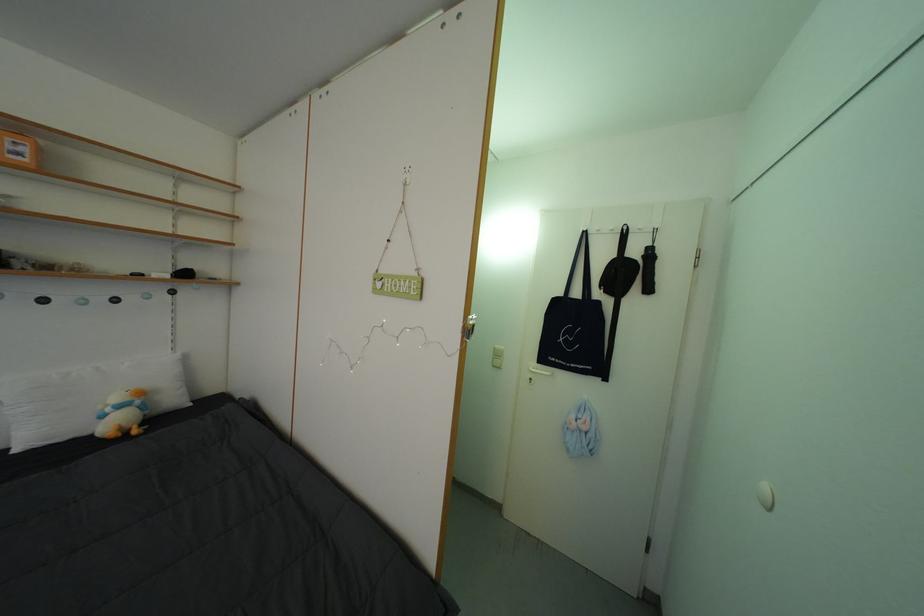
The location [122,414] corresponds to which object?

This point indicates the stuffed penguin toy.